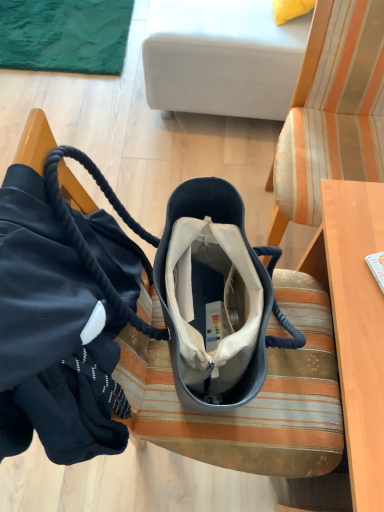
The height and width of the screenshot is (512, 384). Describe the element at coordinates (332, 112) in the screenshot. I see `striped fabric chair at center` at that location.

Where is `velvet bag at center`? velvet bag at center is located at coordinates (251, 401).

Describe the element at coordinates (222, 58) in the screenshot. I see `white fabric studio couch at upper center` at that location.

The height and width of the screenshot is (512, 384). What are the coordinates of `striped fabric chair at center` in the screenshot? It's located at (332, 112).

Which is more to the right, white fabric studio couch at upper center or velvet bag at center?

white fabric studio couch at upper center is more to the right.

Does white fabric studio couch at upper center have a greater width compared to velvet bag at center?

Correct, the width of white fabric studio couch at upper center exceeds that of velvet bag at center.

Is white fabric studio couch at upper center inside or outside of velvet bag at center?

The correct answer is: outside.

From the image's perspective, does white fabric studio couch at upper center appear lower than velvet bag at center?

No, from the image's perspective, white fabric studio couch at upper center is not below velvet bag at center.

In the scene shown: From their relative heights in the image, would you say striped fabric chair at center is taller or shorter than satin black handbag at lower left?

striped fabric chair at center is taller than satin black handbag at lower left.

Considering the relative sizes of striped fabric chair at center and satin black handbag at lower left in the image provided, is striped fabric chair at center wider than satin black handbag at lower left?

Indeed, striped fabric chair at center has a greater width compared to satin black handbag at lower left.

From the image's perspective, would you say striped fabric chair at center is positioned over satin black handbag at lower left?

Correct, striped fabric chair at center appears higher than satin black handbag at lower left in the image.

Is point (372, 52) positioned after point (46, 199)?

Yes, point (372, 52) is behind point (46, 199).

From the image's perspective, relative to white fabric studio couch at upper center, is velvet bag at center above or below?

velvet bag at center is below white fabric studio couch at upper center.

Can you confirm if velvet bag at center is shorter than white fabric studio couch at upper center?

No.

Is velvet bag at center outside of white fabric studio couch at upper center?

Yes, velvet bag at center is outside of white fabric studio couch at upper center.

Are velvet bag at center and white fabric studio couch at upper center beside each other?

No, velvet bag at center is not next to white fabric studio couch at upper center.

Between satin black handbag at lower left and white fabric studio couch at upper center, which one appears on the right side from the viewer's perspective?

Positioned to the right is white fabric studio couch at upper center.

In the scene shown: Can you tell me how much satin black handbag at lower left and white fabric studio couch at upper center differ in facing direction?

The facing directions of satin black handbag at lower left and white fabric studio couch at upper center are 177 degrees apart.

Who is more distant, satin black handbag at lower left or white fabric studio couch at upper center?

white fabric studio couch at upper center is behind.

You are a GUI agent. You are given a task and a screenshot of the screen. Output one action in this format:
    pyautogui.click(x=<x>, y=<y>)
    Task: Click on the handbag below the white fabric studio couch at upper center (from the image's perspective)
    
    Given the screenshot: What is the action you would take?
    pyautogui.click(x=64, y=315)

Between satin black handbag at lower left and velvet bag at center, which one has larger size?

velvet bag at center is bigger.

Can you tell me how much satin black handbag at lower left and velvet bag at center differ in facing direction?

The angle between the facing direction of satin black handbag at lower left and the facing direction of velvet bag at center is 1.79e-05 degrees.

Visually, is satin black handbag at lower left positioned to the left or to the right of velvet bag at center?

From the image, it's evident that satin black handbag at lower left is to the left of velvet bag at center.

From the image's perspective, does satin black handbag at lower left appear lower than velvet bag at center?

No, from the image's perspective, satin black handbag at lower left is not beneath velvet bag at center.

Is velvet bag at center turned away from striped fabric chair at center?

That's not correct — velvet bag at center is not looking away from striped fabric chair at center.

How far apart are velvet bag at center and striped fabric chair at center?

They are 19.45 inches apart.

Does point (165, 353) appear closer or farther from the camera than point (285, 123)?

Point (165, 353) is closer to the camera than point (285, 123).

Is velvet bag at center not near striped fabric chair at center?

No, there isn't a large distance between velvet bag at center and striped fabric chair at center.

Is velvet bag at center looking in the opposite direction of satin black handbag at lower left?

Yes, satin black handbag at lower left is at the back of velvet bag at center.

How different are the orientations of velvet bag at center and satin black handbag at lower left in degrees?

The angular difference between velvet bag at center and satin black handbag at lower left is 1.79e-05 degrees.

Which is behind, point (214, 443) or point (82, 237)?

The point (214, 443) is behind.

Would you consider velvet bag at center to be distant from satin black handbag at lower left?

velvet bag at center is actually quite close to satin black handbag at lower left.

Locate an element on the screen. studio couch behind the velvet bag at center is located at coordinates (222, 58).

Where is `handbag lying in front of the striped fabric chair at center`? handbag lying in front of the striped fabric chair at center is located at coordinates (64, 315).

Looking at the image, which one is located closer to striped fabric chair at center, velvet bag at center or white fabric studio couch at upper center?

white fabric studio couch at upper center.

From the picture: Estimate the real-world distances between objects in this image. Which object is further from satin black handbag at lower left, striped fabric chair at center or velvet bag at center?

striped fabric chair at center lies further to satin black handbag at lower left than the other object.

Which object lies nearer to the anchor point velvet bag at center, striped fabric chair at center or white fabric studio couch at upper center?

The object closer to velvet bag at center is striped fabric chair at center.

From the image, which object appears to be nearer to velvet bag at center, striped fabric chair at center or satin black handbag at lower left?

Based on the image, satin black handbag at lower left appears to be nearer to velvet bag at center.

Looking at this image, from the image, which object appears to be nearer to white fabric studio couch at upper center, velvet bag at center or satin black handbag at lower left?

velvet bag at center.

From the image, which object appears to be farther from white fabric studio couch at upper center, striped fabric chair at center or velvet bag at center?

velvet bag at center is further to white fabric studio couch at upper center.

From the image, which object appears to be farther from white fabric studio couch at upper center, striped fabric chair at center or satin black handbag at lower left?

satin black handbag at lower left.

Estimate the real-world distances between objects in this image. Which object is closer to satin black handbag at lower left, striped fabric chair at center or white fabric studio couch at upper center?

The object closer to satin black handbag at lower left is striped fabric chair at center.

Where is `furniture located between satin black handbag at lower left and striped fabric chair at center in the left-right direction`? furniture located between satin black handbag at lower left and striped fabric chair at center in the left-right direction is located at coordinates (251, 401).

You are a GUI agent. You are given a task and a screenshot of the screen. Output one action in this format:
    pyautogui.click(x=<x>, y=<y>)
    Task: Click on the chair between white fabric studio couch at upper center and velvet bag at center vertically
    The image size is (384, 512).
    Given the screenshot: What is the action you would take?
    pyautogui.click(x=332, y=112)

At what (x,y) coordinates should I click in order to perform the action: click on handbag between white fabric studio couch at upper center and velvet bag at center from top to bottom. Please return your answer as a coordinate pair (x, y). This screenshot has width=384, height=512. Looking at the image, I should click on coord(64,315).

I want to click on chair between white fabric studio couch at upper center and satin black handbag at lower left vertically, so click(332, 112).